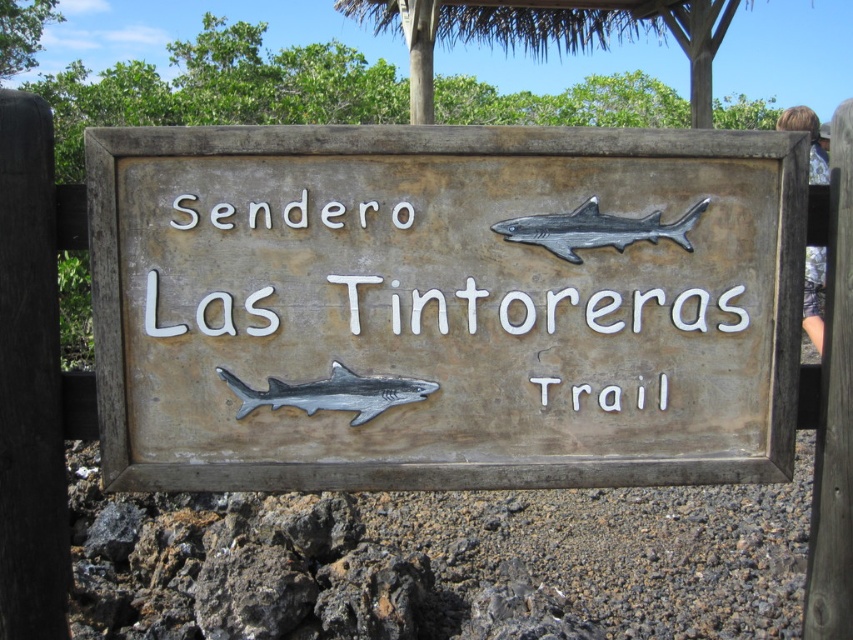
Locate an element on the screen. metallic gray shark at upper center is located at coordinates (595, 228).

Does metallic gray shark at upper center appear on the right side of gray metallic shark at center?

Yes, metallic gray shark at upper center is to the right of gray metallic shark at center.

Measure the distance between metallic gray shark at upper center and camera.

metallic gray shark at upper center is 2.38 meters away from camera.

What are the coordinates of `metallic gray shark at upper center` in the screenshot? It's located at (595, 228).

Who is positioned more to the left, weathered wood sign at center or gray metallic shark at center?

gray metallic shark at center

Which is in front, point (271, 252) or point (380, 380)?

Point (271, 252) is in front.

Which is in front, point (213, 141) or point (357, 384)?

Point (213, 141) is more forward.

In order to click on weathered wood sign at center in this screenshot , I will do `click(444, 307)`.

Where is `weathered wood sign at center`? This screenshot has width=853, height=640. weathered wood sign at center is located at coordinates (444, 307).

Can you confirm if weathered wood sign at center is positioned to the right of metallic gray shark at upper center?

No, weathered wood sign at center is not to the right of metallic gray shark at upper center.

Between point (637, 307) and point (633, 230), which one is positioned behind?

Point (637, 307)

Where is `weathered wood sign at center`? The height and width of the screenshot is (640, 853). weathered wood sign at center is located at coordinates point(444,307).